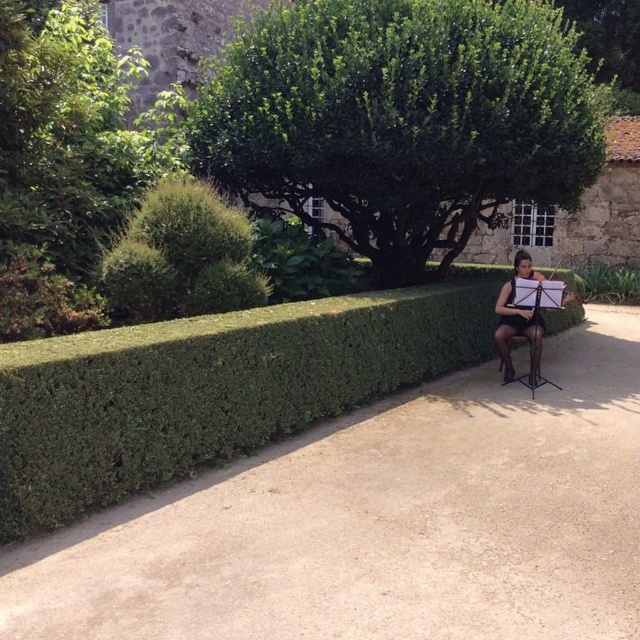
Question: Is dirt path at center bigger than green leafy tree at center?

Choices:
 (A) yes
 (B) no

Answer: (B)

Question: Observing the image, what is the correct spatial positioning of dirt path at center in reference to black sheer dress at right?

Choices:
 (A) above
 (B) below

Answer: (B)

Question: Is dirt path at center thinner than green leafy tree at center?

Choices:
 (A) yes
 (B) no

Answer: (A)

Question: Which object appears farthest from the camera in this image?

Choices:
 (A) black sheer dress at right
 (B) dirt path at center

Answer: (A)

Question: Estimate the real-world distances between objects in this image. Which object is closer to the dirt path at center?

Choices:
 (A) black sheer dress at right
 (B) green leafy tree at center

Answer: (A)

Question: Which object is farther from the camera taking this photo?

Choices:
 (A) black sheer dress at right
 (B) dirt path at center

Answer: (A)